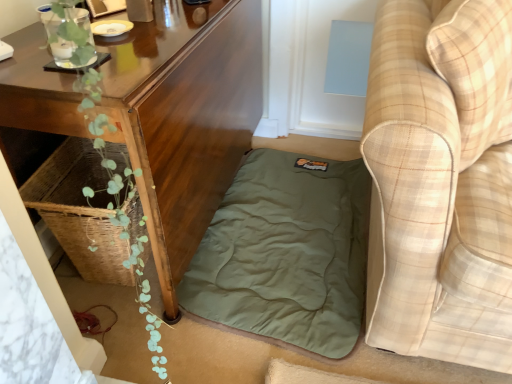
Question: Is olive green fabric mattress at lower center at the back of beige plaid fabric couch at lower right?

Choices:
 (A) yes
 (B) no

Answer: (B)

Question: Considering the relative positions of beige plaid fabric couch at lower right and olive green fabric mattress at lower center in the image provided, is beige plaid fabric couch at lower right to the left of olive green fabric mattress at lower center from the viewer's perspective?

Choices:
 (A) no
 (B) yes

Answer: (A)

Question: From a real-world perspective, does beige plaid fabric couch at lower right stand above olive green fabric mattress at lower center?

Choices:
 (A) no
 (B) yes

Answer: (B)

Question: Is beige plaid fabric couch at lower right far away from olive green fabric mattress at lower center?

Choices:
 (A) no
 (B) yes

Answer: (A)

Question: From a real-world perspective, does beige plaid fabric couch at lower right sit lower than olive green fabric mattress at lower center?

Choices:
 (A) yes
 (B) no

Answer: (B)

Question: Would you say olive green fabric mattress at lower center is part of beige plaid fabric couch at lower right's contents?

Choices:
 (A) yes
 (B) no

Answer: (B)

Question: Considering the relative positions of beige plaid fabric couch at lower right and wooden table at lower left in the image provided, is beige plaid fabric couch at lower right to the left of wooden table at lower left from the viewer's perspective?

Choices:
 (A) no
 (B) yes

Answer: (A)

Question: Is beige plaid fabric couch at lower right closer to camera compared to wooden table at lower left?

Choices:
 (A) yes
 (B) no

Answer: (A)

Question: Is beige plaid fabric couch at lower right aimed at wooden table at lower left?

Choices:
 (A) yes
 (B) no

Answer: (B)

Question: Can you confirm if beige plaid fabric couch at lower right is wider than wooden table at lower left?

Choices:
 (A) yes
 (B) no

Answer: (A)

Question: From the image's perspective, is beige plaid fabric couch at lower right located beneath wooden table at lower left?

Choices:
 (A) yes
 (B) no

Answer: (A)

Question: From a real-world perspective, does beige plaid fabric couch at lower right sit lower than wooden table at lower left?

Choices:
 (A) no
 (B) yes

Answer: (A)

Question: From a real-world perspective, is olive green fabric mattress at lower center physically above beige plaid fabric couch at lower right?

Choices:
 (A) no
 (B) yes

Answer: (A)